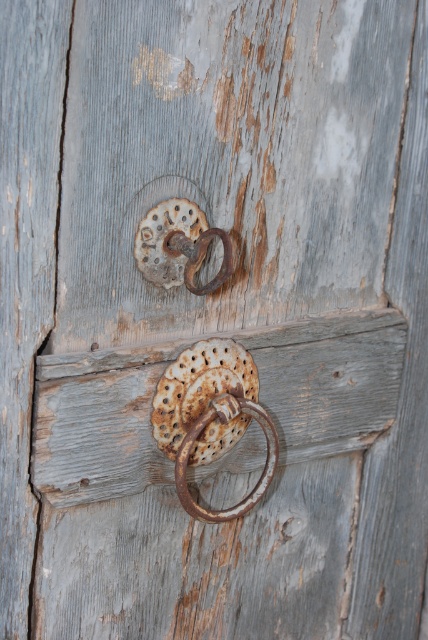
Is rusty metal door handle at center to the left of rusty metal ring at center from the viewer's perspective?

No, rusty metal door handle at center is not to the left of rusty metal ring at center.

Who is higher up, rusty metal door handle at center or rusty metal ring at center?

rusty metal ring at center is above.

Between point (177, 492) and point (175, 280), which one is positioned behind?

The point (177, 492) is behind.

Locate an element on the screen. The width and height of the screenshot is (428, 640). rusty metal door handle at center is located at coordinates (210, 417).